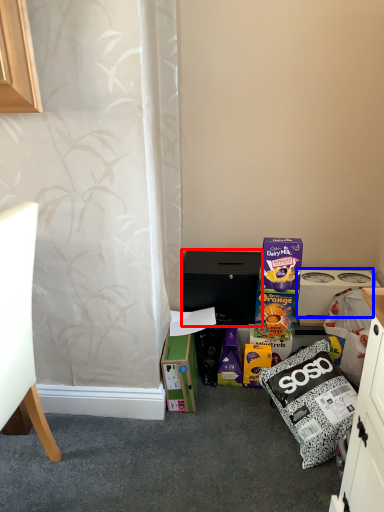
Question: Which point is further to the camera, cabinetry (highlighted by a red box) or appliance (highlighted by a blue box)?

Choices:
 (A) cabinetry
 (B) appliance

Answer: (B)